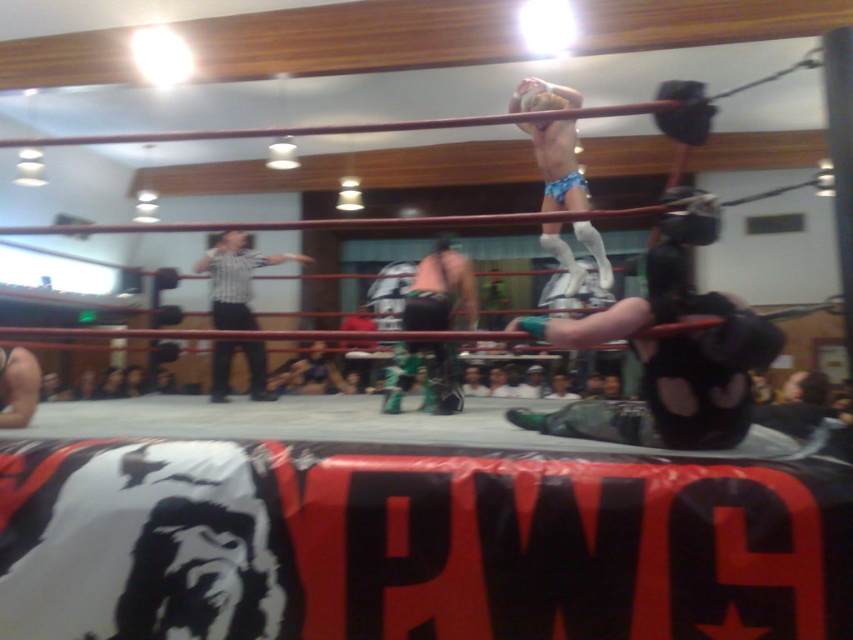
Is point (717, 221) farther from camera compared to point (405, 301)?

No.

Describe the element at coordinates (670, 348) in the screenshot. I see `blue fabric shorts at upper right` at that location.

Does point (704, 298) lie behind point (463, 301)?

No, it is in front of (463, 301).

Find the location of a particular element. This screenshot has height=640, width=853. blue fabric shorts at upper right is located at coordinates (670, 348).

Measure the distance from green fabric pants at center to striped shirt at center.

1.33 meters

Is point (426, 289) closer to camera compared to point (207, 253)?

Yes.

Is point (395, 376) positioned before point (252, 257)?

That is True.

Locate an element on the screen. green fabric pants at center is located at coordinates (439, 291).

Does blue fabric shorts at upper right come behind striped shirt at center?

No, blue fabric shorts at upper right is in front of striped shirt at center.

Between point (698, 433) and point (241, 292), which one is positioned behind?

The point (241, 292) is more distant.

Is point (567, 337) less distant than point (224, 243)?

Yes, it is.

The width and height of the screenshot is (853, 640). I want to click on blue fabric shorts at upper right, so click(x=670, y=348).